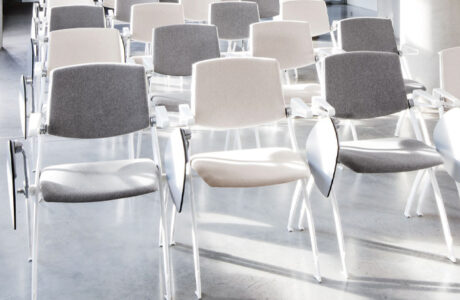
Find the location of `moveable table rest (not in use)`. moveable table rest (not in use) is located at coordinates (180, 168), (12, 182), (23, 103), (33, 57), (35, 30), (322, 153), (445, 137).